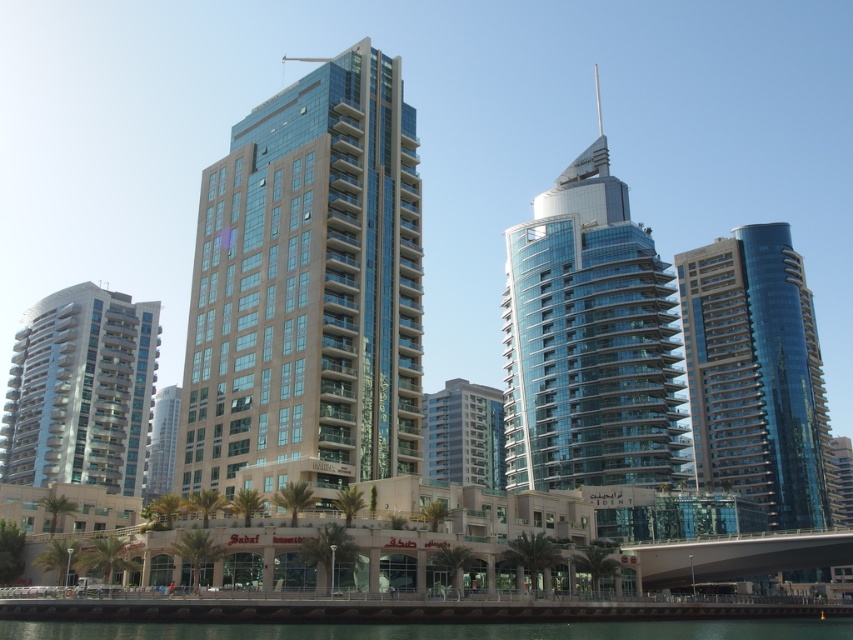
Is matte glass building at left further to the viewer compared to transparent glass water at lower center?

That is True.

This screenshot has height=640, width=853. What do you see at coordinates (80, 390) in the screenshot?
I see `matte glass building at left` at bounding box center [80, 390].

What do you see at coordinates (80, 390) in the screenshot?
I see `matte glass building at left` at bounding box center [80, 390].

Image resolution: width=853 pixels, height=640 pixels. I want to click on matte glass building at left, so click(x=80, y=390).

Which is behind, point (735, 244) or point (277, 634)?

Positioned behind is point (735, 244).

Is shiny blue glass building at right positioned at the back of transparent glass water at lower center?

Yes, shiny blue glass building at right is behind transparent glass water at lower center.

Which is behind, point (776, 404) or point (595, 625)?

Positioned behind is point (776, 404).

The height and width of the screenshot is (640, 853). I want to click on shiny blue glass building at right, so click(757, 376).

Between beige glass building at center and shiny glass skyscraper at center, which one has less height?

Standing shorter between the two is beige glass building at center.

Can you confirm if beige glass building at center is taller than shiny glass skyscraper at center?

No, beige glass building at center is not taller than shiny glass skyscraper at center.

Who is more forward, (x=397, y=278) or (x=572, y=312)?

Point (x=397, y=278) is more forward.

You are a GUI agent. You are given a task and a screenshot of the screen. Output one action in this format:
    pyautogui.click(x=<x>, y=<y>)
    Task: Click on the beige glass building at center
    The image size is (853, 640).
    Given the screenshot: What is the action you would take?
    pyautogui.click(x=308, y=289)